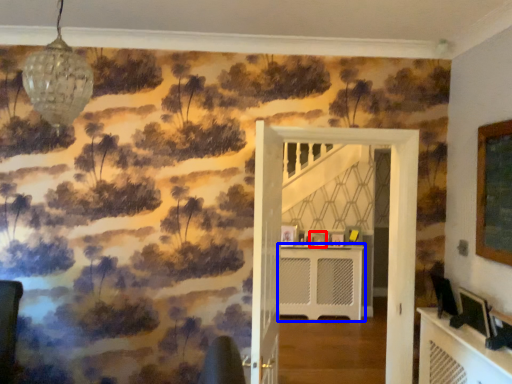
Question: Which point is further to the camera, picture frame (highlighted by a red box) or table (highlighted by a blue box)?

Choices:
 (A) picture frame
 (B) table

Answer: (A)